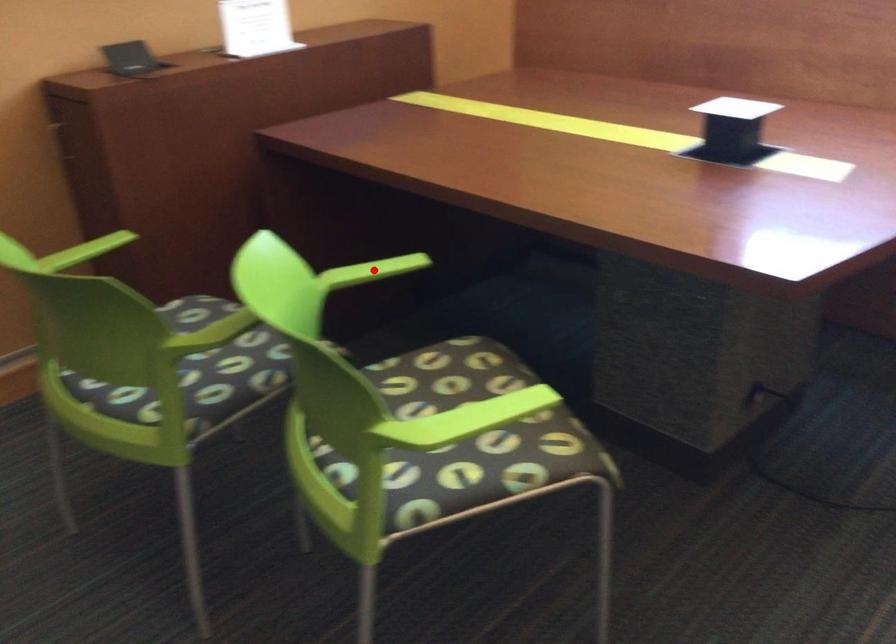
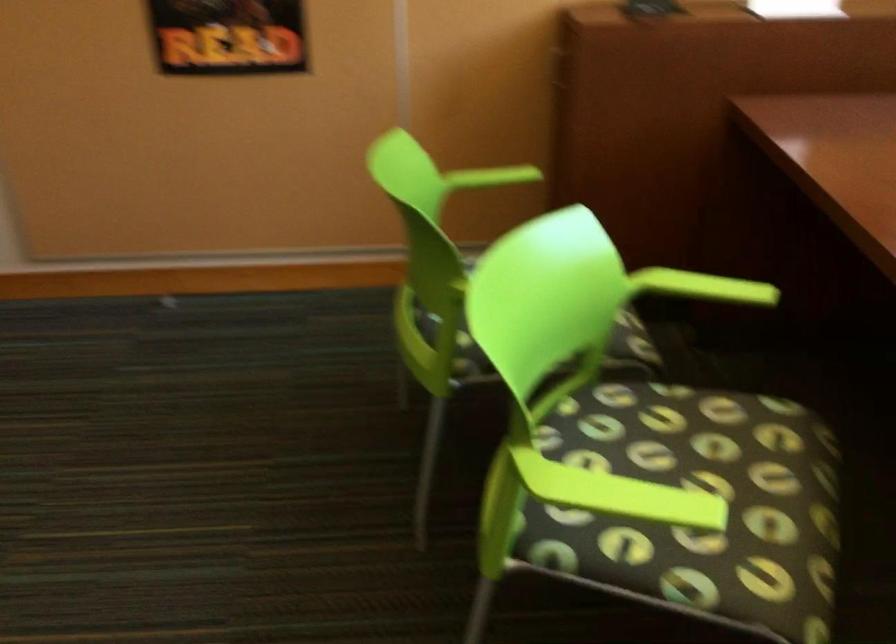
Question: I am providing you with two images of the same scene from different viewpoints. A red point is marked on the first image. At the location where the point appears in image 1, is it still visible in image 2?

Choices:
 (A) Yes
 (B) No

Answer: (A)